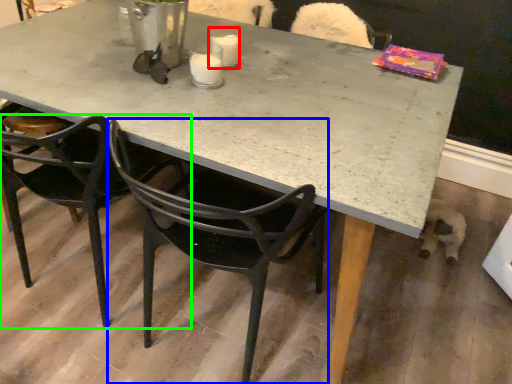
Question: Which object is positioned closest to coffee cup (highlighted by a red box)? Select from chair (highlighted by a blue box) and chair (highlighted by a green box).

Choices:
 (A) chair
 (B) chair

Answer: (A)